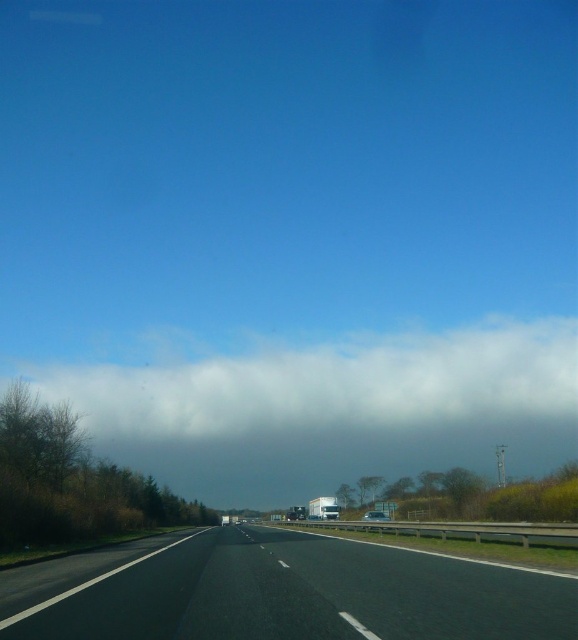
Is black asphalt highway at center wider than metallic silver trailer truck at center?

Yes, black asphalt highway at center is wider than metallic silver trailer truck at center.

Find the location of a particular element. This screenshot has width=578, height=640. black asphalt highway at center is located at coordinates (292, 593).

Image resolution: width=578 pixels, height=640 pixels. In order to click on black asphalt highway at center in this screenshot , I will do `click(292, 593)`.

Is metallic silver trailer truck at center smaller than silver metallic van at center?

Actually, metallic silver trailer truck at center might be larger than silver metallic van at center.

Which of these two, metallic silver trailer truck at center or silver metallic van at center, stands taller?

metallic silver trailer truck at center is taller.

Does point (331, 512) come behind point (387, 516)?

That is False.

Identify the location of metallic silver trailer truck at center. (324, 508).

Who is positioned more to the right, white fluffy cloud at upper center or metallic silver trailer truck at center?

Positioned to the right is metallic silver trailer truck at center.

Between white fluffy cloud at upper center and metallic silver trailer truck at center, which one is positioned higher?

white fluffy cloud at upper center is above.

Is point (317, 400) less distant than point (309, 513)?

No, (317, 400) is behind (309, 513).

Locate an element on the screen. white fluffy cloud at upper center is located at coordinates (335, 387).